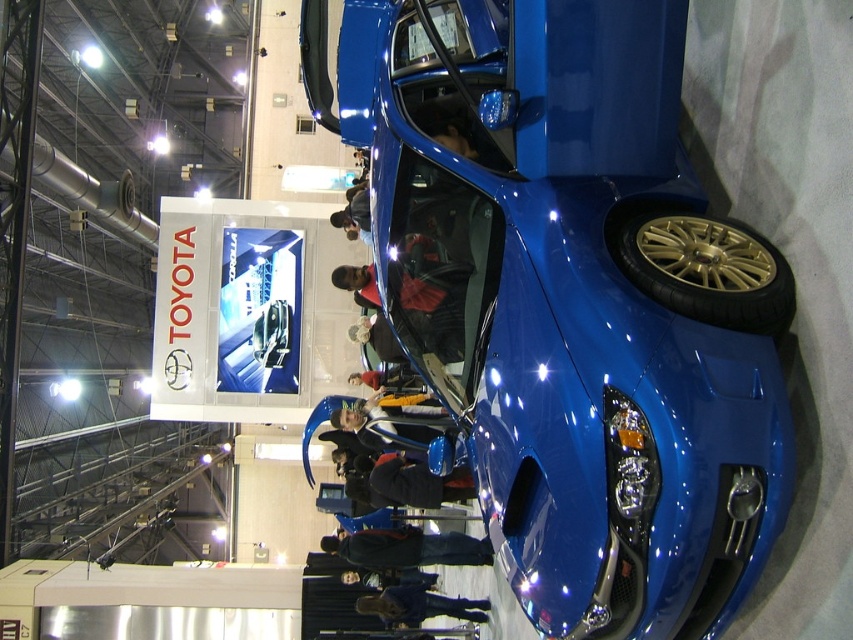
Question: Does shiny blue car at center appear under gold metallic tire at lower right?

Choices:
 (A) yes
 (B) no

Answer: (B)

Question: Can you confirm if shiny blue car at center is bigger than gold metallic tire at lower right?

Choices:
 (A) no
 (B) yes

Answer: (B)

Question: Which point is closer to the camera?

Choices:
 (A) tap(718, 244)
 (B) tap(759, 284)

Answer: (B)

Question: Does shiny blue car at center appear over gold metallic tire at lower right?

Choices:
 (A) no
 (B) yes

Answer: (B)

Question: Among these points, which one is nearest to the camera?

Choices:
 (A) (683, 301)
 (B) (343, 17)

Answer: (A)